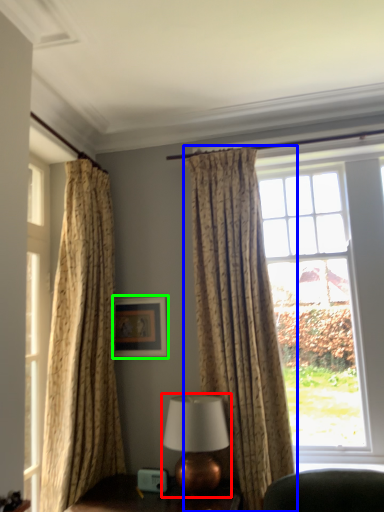
Question: Which object is the closest to the table lamp (highlighted by a red box)? Choose among these: curtain (highlighted by a blue box) or picture frame (highlighted by a green box).

Choices:
 (A) curtain
 (B) picture frame

Answer: (A)